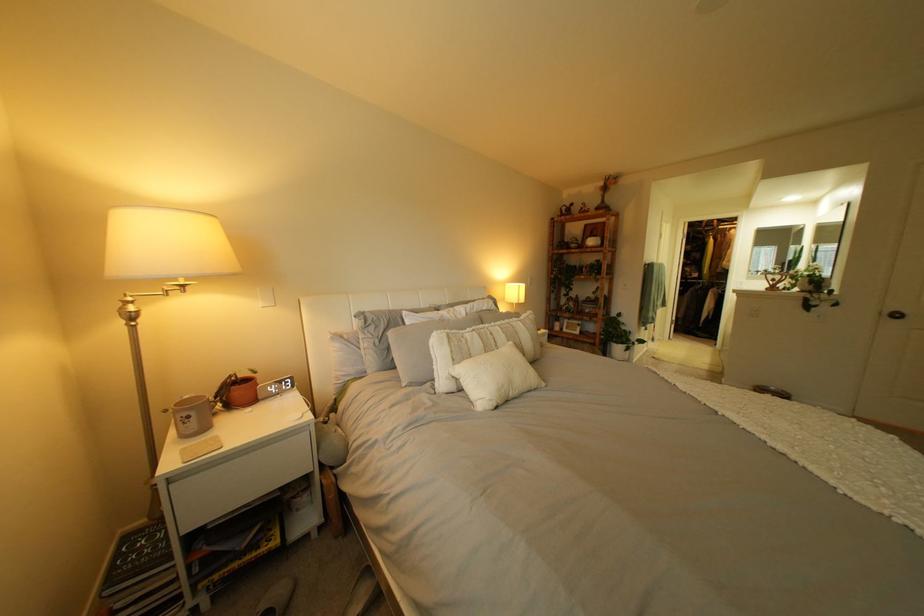
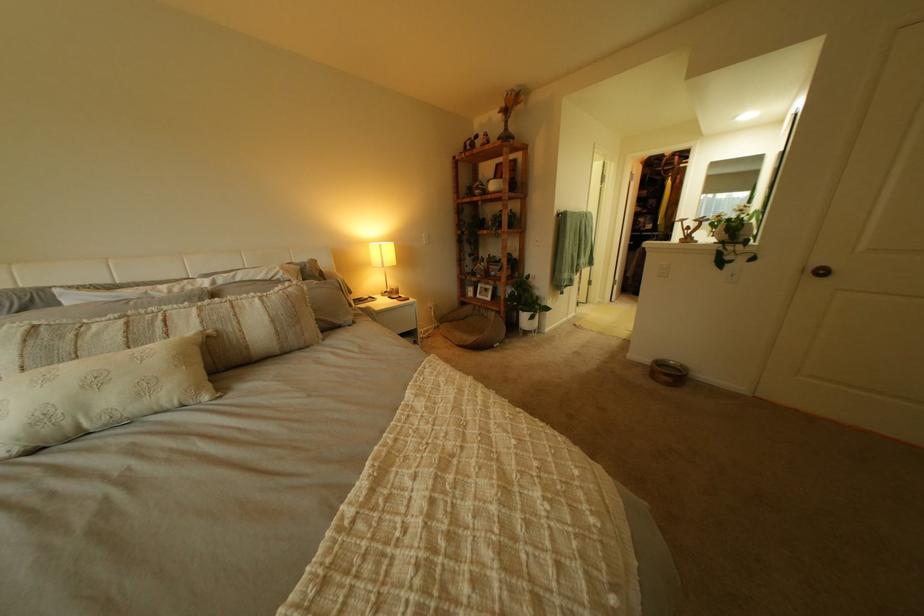
Where in the second image is the point corresponding to (x=518, y=337) from the first image?

(213, 323)